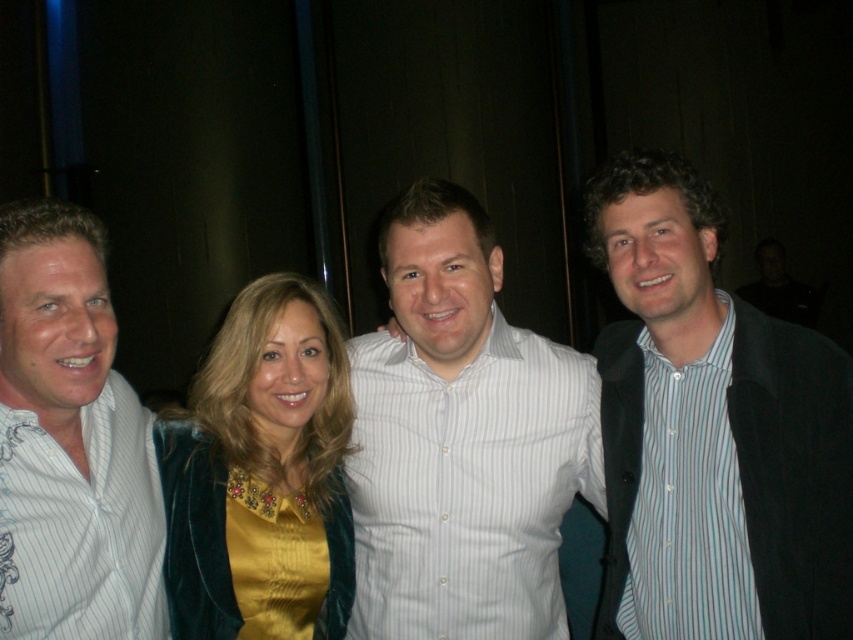
Looking at the group photo, where is the white striped shirt at center positioned relative to the white striped shirt at left?

The white striped shirt at center is positioned to the right of the white striped shirt at left.

You are standing at the point labeled point (540,476) and want to take a photo of the group. The camera you have requires you to be at least 2 meters away from the subject to focus properly. Will you be able to take a clear photo with the camera from your current position?

The distance between point (540,476) and the camera is 1.93 meters. Since the camera requires a minimum distance of 2 meters to focus properly, you are too close to take a clear photo. You need to move back to ensure you are at least 2 meters away.